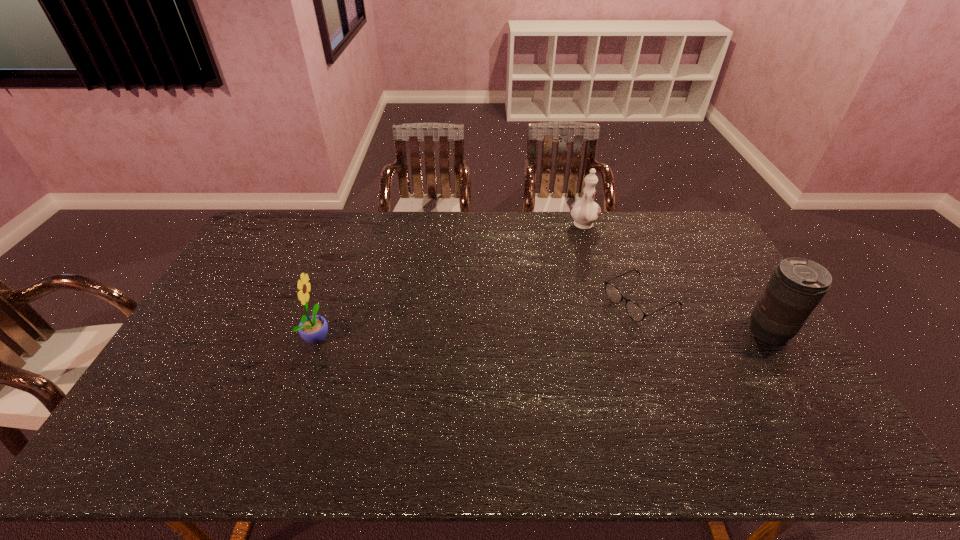
At what (x,y) coordinates should I click in order to perform the action: click on free space at the near left corner. Please return your answer as a coordinate pair (x, y). The image size is (960, 540). Looking at the image, I should click on (182, 401).

The width and height of the screenshot is (960, 540). I want to click on free space between the chinaware and the shortest object, so click(x=612, y=262).

This screenshot has height=540, width=960. Find the location of `unoccupied position between the rightmost object and the spectacles`. unoccupied position between the rightmost object and the spectacles is located at coordinates (705, 315).

Find the location of a particular element. This screenshot has height=540, width=960. vacant area between the leftmost object and the shortest object is located at coordinates (479, 318).

At what (x,y) coordinates should I click in order to perform the action: click on vacant space that is in between the leftmost object and the farthest object. Please return your answer as a coordinate pair (x, y). This screenshot has height=540, width=960. Looking at the image, I should click on (451, 281).

Locate an element on the screen. The width and height of the screenshot is (960, 540). free area in between the rightmost object and the leftmost object is located at coordinates (543, 334).

Identify the location of blank region between the chinaware and the telephoto lens. (676, 279).

Find the location of a particular element. The image size is (960, 540). unoccupied area between the sunflower and the telephoto lens is located at coordinates (543, 334).

Identify the location of empty location between the spectacles and the farthest object. (612, 262).

This screenshot has height=540, width=960. In order to click on free space between the telephoto lens and the chinaware in this screenshot , I will do `click(676, 279)`.